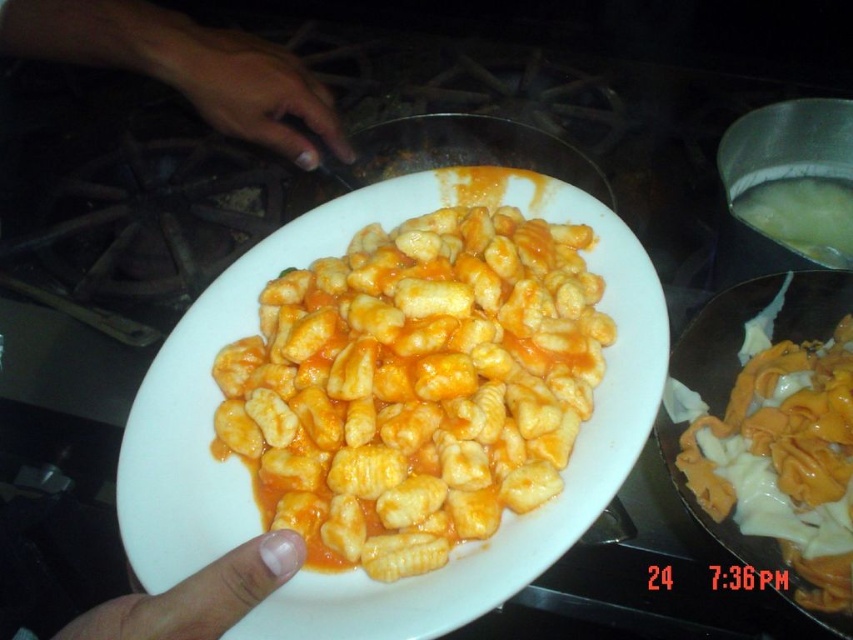
Question: Which point is farther from the camera taking this photo?

Choices:
 (A) (212, 586)
 (B) (840, 422)
 (C) (260, 566)
 (D) (328, 120)

Answer: (D)

Question: Which of the following is the farthest from the observer?

Choices:
 (A) (283, 68)
 (B) (119, 614)
 (C) (196, 64)
 (D) (251, 573)

Answer: (A)

Question: Is yellow matte gnocchi at center thinner than smooth skin hand at upper center?

Choices:
 (A) yes
 (B) no

Answer: (B)

Question: Is yellow matte gnocchi at center closer to camera compared to smooth skin hand at center?

Choices:
 (A) yes
 (B) no

Answer: (A)

Question: Which point appears closest to the camera in this image?

Choices:
 (A) (74, 12)
 (B) (254, 99)

Answer: (A)

Question: Can you confirm if yellow matte gnocchi at center is positioned to the right of smooth skin hand at upper left?

Choices:
 (A) no
 (B) yes

Answer: (B)